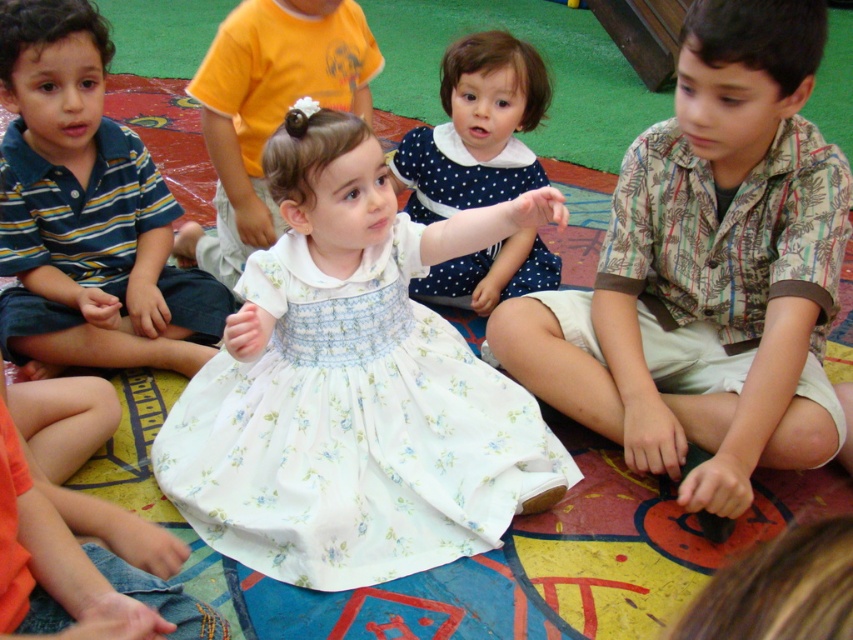
Question: Where is striped cotton shirt at left located in relation to matte yellow shirt at center in the image?

Choices:
 (A) above
 (B) below

Answer: (B)

Question: Estimate the real-world distances between objects in this image. Which object is farther from the white floral fabric dress at center?

Choices:
 (A) printed cotton shirt at center
 (B) matte yellow shirt at center

Answer: (A)

Question: Does printed cotton shirt at center have a lesser width compared to white floral dress at center?

Choices:
 (A) yes
 (B) no

Answer: (A)

Question: Which point is farther to the camera?

Choices:
 (A) (440, 198)
 (B) (213, 64)
 (C) (445, 458)
 (D) (750, 294)

Answer: (A)

Question: Which object is farther from the camera taking this photo?

Choices:
 (A) striped cotton shirt at left
 (B) matte yellow shirt at center

Answer: (B)

Question: Considering the relative positions of printed cotton shirt at center and white floral fabric dress at center in the image provided, where is printed cotton shirt at center located with respect to white floral fabric dress at center?

Choices:
 (A) below
 (B) above

Answer: (A)